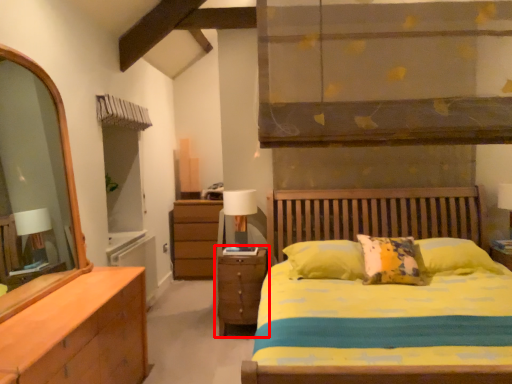
Question: From the image's perspective, what is the correct spatial positioning of nightstand (annotated by the red box) in reference to table lamp?

Choices:
 (A) above
 (B) below

Answer: (B)